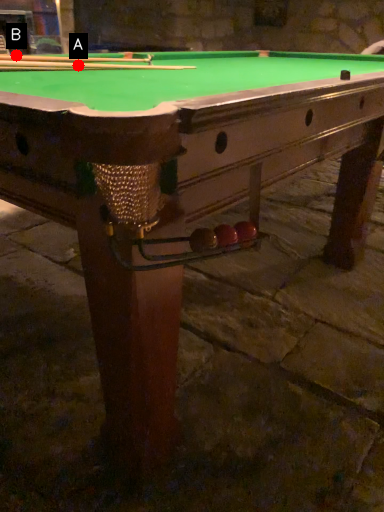
Question: Two points are circled on the image, labeled by A and B beside each circle. Which point is closer to the camera taking this photo?

Choices:
 (A) A is closer
 (B) B is closer

Answer: (A)